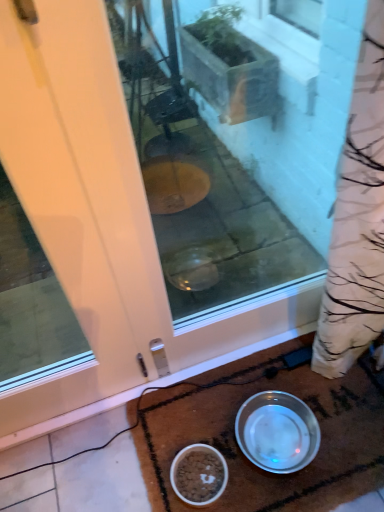
Describe the element at coordinates (57, 240) in the screenshot. I see `white glossy door at center` at that location.

Where is `brown textured doormat at lower center`? The height and width of the screenshot is (512, 384). brown textured doormat at lower center is located at coordinates (239, 448).

Identify the location of white glossy door at center. (x=57, y=240).

Considering the positions of objects brown textured doormat at lower center and silver metallic bowl at lower center, which ranks as the 2th bowl in left-to-right order, in the image provided, who is more to the left, brown textured doormat at lower center or silver metallic bowl at lower center, which ranks as the 2th bowl in left-to-right order,?

brown textured doormat at lower center is more to the left.

From the image's perspective, does brown textured doormat at lower center appear higher than silver metallic bowl at lower center, which ranks as the 2th bowl in left-to-right order?

No, from the image's perspective, brown textured doormat at lower center is not over silver metallic bowl at lower center, which ranks as the 2th bowl in left-to-right order.

Based on the photo, considering the positions of objects brown textured doormat at lower center and silver metallic bowl at lower center, which ranks as the 2th bowl in left-to-right order, in the image provided, who is behind, brown textured doormat at lower center or silver metallic bowl at lower center, which ranks as the 2th bowl in left-to-right order,?

silver metallic bowl at lower center, which ranks as the 2th bowl in left-to-right order, is further from the camera.

Which is more to the right, white glossy door at center or white glossy bowl at lower center, the second bowl from the right?

white glossy bowl at lower center, the second bowl from the right, is more to the right.

In the scene shown: From a real-world perspective, relative to white glossy bowl at lower center, the second bowl from the right, is white glossy door at center vertically above or below?

From a real-world perspective, white glossy door at center is physically above white glossy bowl at lower center, the second bowl from the right.

Which object is closer to the camera, white glossy door at center or white glossy bowl at lower center, which is the 1th bowl in left-to-right order?

white glossy door at center.

Considering the relative sizes of white glossy door at center and white glossy bowl at lower center, which is the 1th bowl in left-to-right order, in the image provided, is white glossy door at center taller than white glossy bowl at lower center, which is the 1th bowl in left-to-right order,?

Indeed, white glossy door at center has a greater height compared to white glossy bowl at lower center, which is the 1th bowl in left-to-right order.

Considering the relative sizes of silver metallic bowl at lower center, which ranks as the 2th bowl in left-to-right order, and white glossy bowl at lower center, the second bowl from the right, in the image provided, is silver metallic bowl at lower center, which ranks as the 2th bowl in left-to-right order, thinner than white glossy bowl at lower center, the second bowl from the right,?

Incorrect, the width of silver metallic bowl at lower center, which ranks as the 2th bowl in left-to-right order, is not less than that of white glossy bowl at lower center, the second bowl from the right.

Is point (268, 426) positioned behind point (203, 502)?

Yes, it is.

Are silver metallic bowl at lower center, arranged as the 1th bowl when viewed from the right, and white glossy bowl at lower center, which is the 1th bowl in left-to-right order, beside each other?

No, silver metallic bowl at lower center, arranged as the 1th bowl when viewed from the right, is not beside white glossy bowl at lower center, which is the 1th bowl in left-to-right order.

Considering the sizes of objects silver metallic bowl at lower center, arranged as the 1th bowl when viewed from the right, and white glossy bowl at lower center, which is the 1th bowl in left-to-right order, in the image provided, who is bigger, silver metallic bowl at lower center, arranged as the 1th bowl when viewed from the right, or white glossy bowl at lower center, which is the 1th bowl in left-to-right order,?

With larger size is silver metallic bowl at lower center, arranged as the 1th bowl when viewed from the right.

Considering the sizes of objects silver metallic bowl at lower center, arranged as the 1th bowl when viewed from the right, and white glossy door at center in the image provided, who is thinner, silver metallic bowl at lower center, arranged as the 1th bowl when viewed from the right, or white glossy door at center?

With smaller width is white glossy door at center.

Considering the relative positions of silver metallic bowl at lower center, arranged as the 1th bowl when viewed from the right, and white glossy door at center in the image provided, is silver metallic bowl at lower center, arranged as the 1th bowl when viewed from the right, to the right of white glossy door at center from the viewer's perspective?

Yes.

Looking at this image, is silver metallic bowl at lower center, arranged as the 1th bowl when viewed from the right, completely or partially outside of white glossy door at center?

Yes, silver metallic bowl at lower center, arranged as the 1th bowl when viewed from the right, is not within white glossy door at center.

From the image's perspective, is silver metallic bowl at lower center, arranged as the 1th bowl when viewed from the right, above white glossy door at center?

No, from the image's perspective, silver metallic bowl at lower center, arranged as the 1th bowl when viewed from the right, is not above white glossy door at center.

Would you consider brown textured doormat at lower center to be distant from white glossy door at center?

That's not correct — brown textured doormat at lower center is a little close to white glossy door at center.

How many degrees apart are the facing directions of brown textured doormat at lower center and white glossy door at center?

The angle between the facing direction of brown textured doormat at lower center and the facing direction of white glossy door at center is 89.9 degrees.

From a real-world perspective, relative to white glossy door at center, is brown textured doormat at lower center vertically above or below?

Answer: In terms of real-world spatial position, brown textured doormat at lower center is below white glossy door at center.

Considering the sizes of objects brown textured doormat at lower center and white glossy door at center in the image provided, who is wider, brown textured doormat at lower center or white glossy door at center?

brown textured doormat at lower center is wider.

From a real-world perspective, which object rests below the other?

brown textured doormat at lower center is physically lower.

Is white glossy bowl at lower center, which is the 1th bowl in left-to-right order, positioned with its back to brown textured doormat at lower center?

white glossy bowl at lower center, which is the 1th bowl in left-to-right order, is not turned away from brown textured doormat at lower center.

From the picture: Which object is closer to the camera, white glossy bowl at lower center, the second bowl from the right, or brown textured doormat at lower center?

Positioned in front is brown textured doormat at lower center.

From the image's perspective, is white glossy bowl at lower center, which is the 1th bowl in left-to-right order, under silver metallic bowl at lower center, which ranks as the 2th bowl in left-to-right order?

Yes.

From a real-world perspective, between white glossy bowl at lower center, which is the 1th bowl in left-to-right order, and silver metallic bowl at lower center, arranged as the 1th bowl when viewed from the right, who is vertically higher?

silver metallic bowl at lower center, arranged as the 1th bowl when viewed from the right.

Would you say white glossy bowl at lower center, the second bowl from the right, is a long distance from silver metallic bowl at lower center, which ranks as the 2th bowl in left-to-right order?

white glossy bowl at lower center, the second bowl from the right, is actually quite close to silver metallic bowl at lower center, which ranks as the 2th bowl in left-to-right order.

Which object is more forward, white glossy bowl at lower center, which is the 1th bowl in left-to-right order, or silver metallic bowl at lower center, arranged as the 1th bowl when viewed from the right?

white glossy bowl at lower center, which is the 1th bowl in left-to-right order, is more forward.

The image size is (384, 512). Identify the location of doormat lying in front of the silver metallic bowl at lower center, which ranks as the 2th bowl in left-to-right order. (239, 448).

Identify the location of bowl that is the 2nd object located below the white glossy door at center (from the image's perspective). This screenshot has height=512, width=384. (199, 474).

Considering their positions, is white glossy door at center positioned closer to brown textured doormat at lower center than silver metallic bowl at lower center, which ranks as the 2th bowl in left-to-right order?

Based on the image, silver metallic bowl at lower center, which ranks as the 2th bowl in left-to-right order, appears to be nearer to brown textured doormat at lower center.

Considering their positions, is white glossy bowl at lower center, which is the 1th bowl in left-to-right order, positioned closer to silver metallic bowl at lower center, which ranks as the 2th bowl in left-to-right order, than white glossy door at center?

white glossy bowl at lower center, which is the 1th bowl in left-to-right order, is positioned closer to the anchor silver metallic bowl at lower center, which ranks as the 2th bowl in left-to-right order.

Looking at the image, which one is located closer to silver metallic bowl at lower center, which ranks as the 2th bowl in left-to-right order, white glossy door at center or white glossy bowl at lower center, which is the 1th bowl in left-to-right order?

white glossy bowl at lower center, which is the 1th bowl in left-to-right order, lies closer to silver metallic bowl at lower center, which ranks as the 2th bowl in left-to-right order, than the other object.

When comparing their distances from white glossy door at center, does silver metallic bowl at lower center, arranged as the 1th bowl when viewed from the right, or brown textured doormat at lower center seem closer?

brown textured doormat at lower center.

Looking at the image, which one is located closer to brown textured doormat at lower center, white glossy bowl at lower center, the second bowl from the right, or silver metallic bowl at lower center, which ranks as the 2th bowl in left-to-right order?

silver metallic bowl at lower center, which ranks as the 2th bowl in left-to-right order.

Based on their spatial positions, is white glossy bowl at lower center, which is the 1th bowl in left-to-right order, or white glossy door at center further from brown textured doormat at lower center?

white glossy door at center.

Considering their positions, is brown textured doormat at lower center positioned further to white glossy bowl at lower center, which is the 1th bowl in left-to-right order, than white glossy door at center?

white glossy door at center lies further to white glossy bowl at lower center, which is the 1th bowl in left-to-right order, than the other object.

Which object lies nearer to the anchor point white glossy bowl at lower center, which is the 1th bowl in left-to-right order, brown textured doormat at lower center or silver metallic bowl at lower center, which ranks as the 2th bowl in left-to-right order?

Among the two, silver metallic bowl at lower center, which ranks as the 2th bowl in left-to-right order, is located nearer to white glossy bowl at lower center, which is the 1th bowl in left-to-right order.

Where is `doormat between white glossy door at center and silver metallic bowl at lower center, arranged as the 1th bowl when viewed from the right, from left to right`? This screenshot has width=384, height=512. doormat between white glossy door at center and silver metallic bowl at lower center, arranged as the 1th bowl when viewed from the right, from left to right is located at coordinates (239, 448).

Find the location of a particular element. bowl located between white glossy door at center and silver metallic bowl at lower center, arranged as the 1th bowl when viewed from the right, in the depth direction is located at coordinates (199, 474).

This screenshot has height=512, width=384. Find the location of `doormat located between white glossy bowl at lower center, the second bowl from the right, and silver metallic bowl at lower center, arranged as the 1th bowl when viewed from the right, in the left-right direction`. doormat located between white glossy bowl at lower center, the second bowl from the right, and silver metallic bowl at lower center, arranged as the 1th bowl when viewed from the right, in the left-right direction is located at coordinates (239, 448).

The image size is (384, 512). In order to click on bowl situated between white glossy door at center and brown textured doormat at lower center from left to right in this screenshot , I will do `click(199, 474)`.